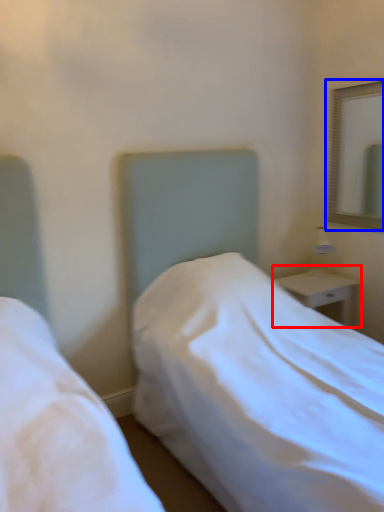
Question: Which of the following is the farthest to the observer, nightstand (highlighted by a red box) or mirror (highlighted by a blue box)?

Choices:
 (A) nightstand
 (B) mirror

Answer: (A)